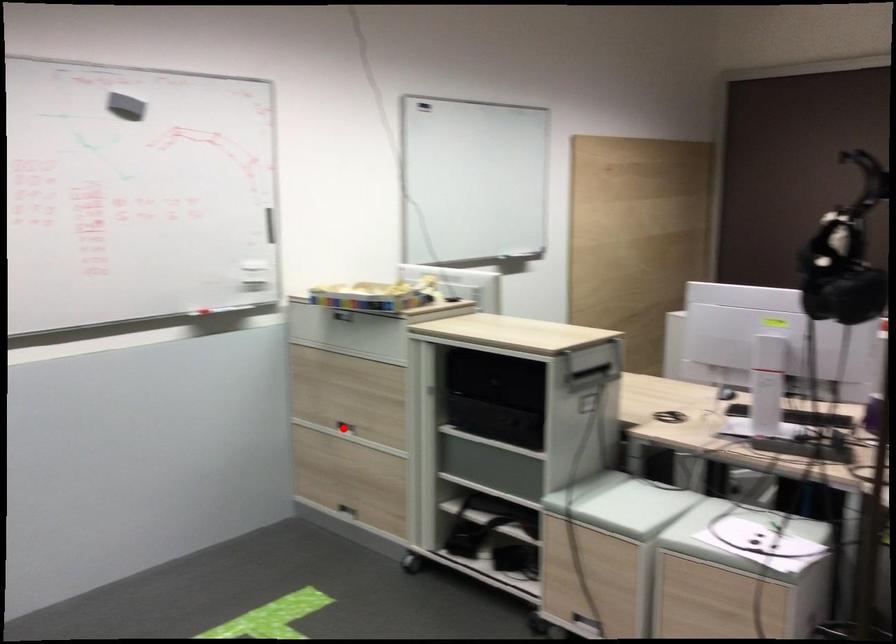
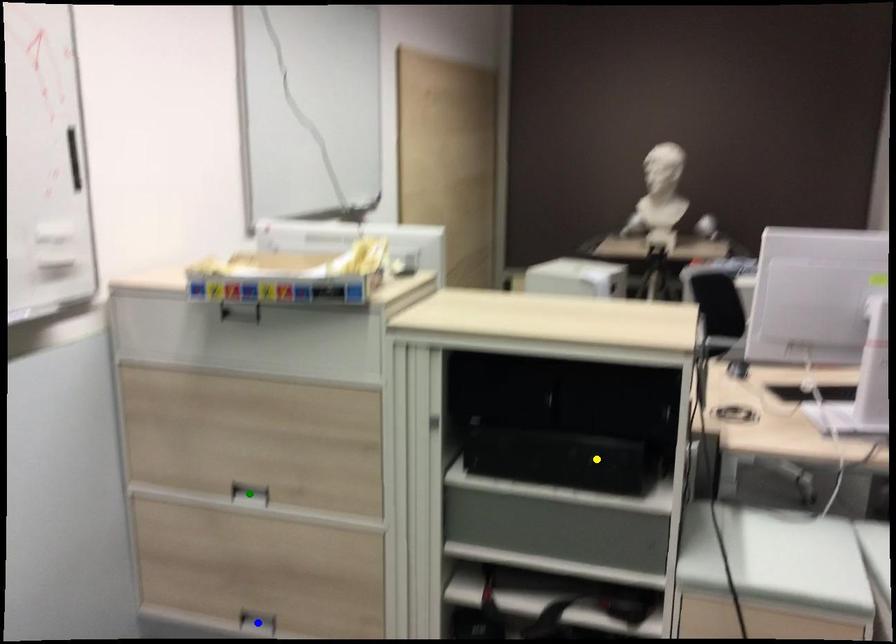
Question: I am providing you with two images of the same scene from different viewpoints. A red point is marked on the first image. You are given multiple points on the second image. In image 2, which mark is for the same physical point as the one in image 1?

Choices:
 (A) yellow point
 (B) green point
 (C) blue point

Answer: (B)